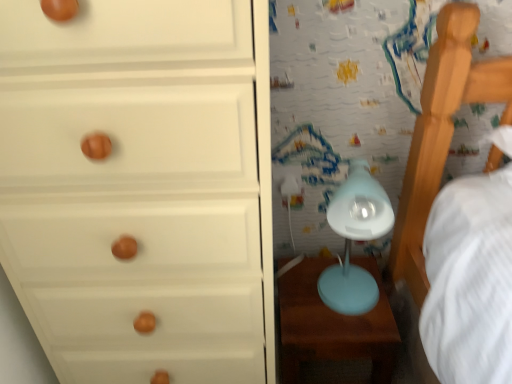
Question: Is matte blue table at lower right inside or outside of matte blue table lamp at center-right?

Choices:
 (A) outside
 (B) inside

Answer: (A)

Question: From their relative heights in the image, would you say matte blue table at lower right is taller or shorter than matte blue table lamp at center-right?

Choices:
 (A) short
 (B) tall

Answer: (A)

Question: Estimate the real-world distances between objects in this image. Which object is farther from the matte blue table at lower right?

Choices:
 (A) white matte chest of drawers at left
 (B) matte blue table lamp at center-right

Answer: (A)

Question: Which of these objects is positioned farthest from the matte blue table at lower right?

Choices:
 (A) white matte chest of drawers at left
 (B) matte blue table lamp at center-right

Answer: (A)